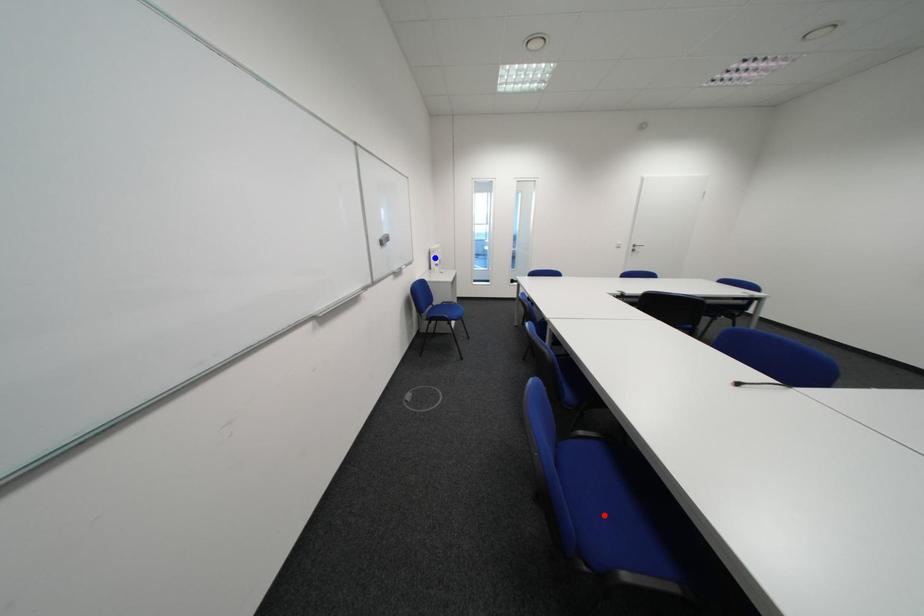
Question: In the image, two points are highlighted. Which point is nearer to the camera? Reply with the corresponding letter.

Choices:
 (A) blue point
 (B) red point

Answer: (B)